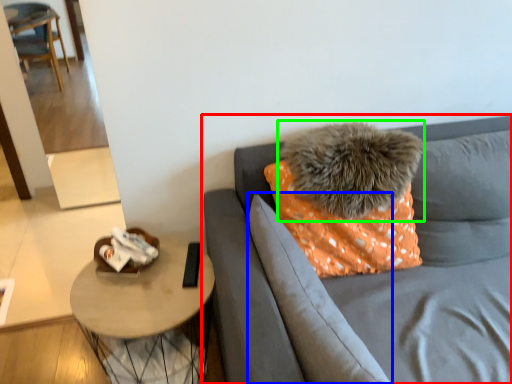
Question: Which is nearer to the studio couch (highlighted by a red box)? pillow (highlighted by a blue box) or pillow (highlighted by a green box).

Choices:
 (A) pillow
 (B) pillow

Answer: (A)